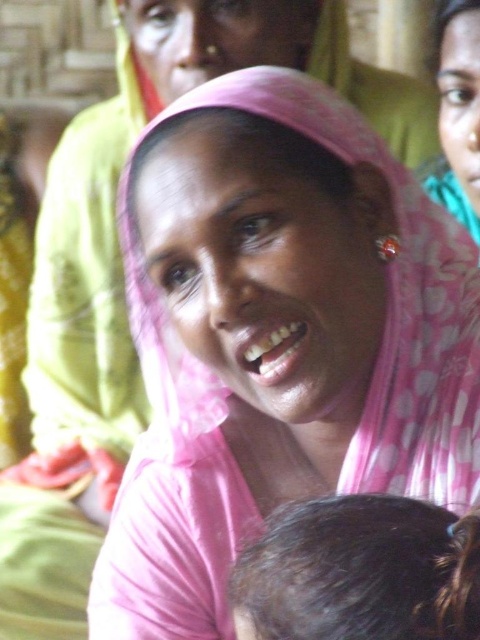
Question: Is pink fabric headscarf at center to the left of dark brown hair at lower center from the viewer's perspective?

Choices:
 (A) yes
 (B) no

Answer: (A)

Question: Which point appears closest to the camera in this image?

Choices:
 (A) (167, 538)
 (B) (251, 584)

Answer: (B)

Question: Among these points, which one is farthest from the camera?

Choices:
 (A) (332, 506)
 (B) (450, 109)
 (C) (444, 481)

Answer: (B)

Question: From the image, what is the correct spatial relationship of pink fabric headscarf at center in relation to pink fabric headscarf at upper center?

Choices:
 (A) left
 (B) right

Answer: (A)

Question: Among these points, which one is nearest to the camera?

Choices:
 (A) (321, 518)
 (B) (106, 620)
 (C) (435, 172)

Answer: (A)

Question: In this image, where is pink fabric headscarf at center located relative to pink fabric headscarf at upper center?

Choices:
 (A) below
 (B) above

Answer: (A)